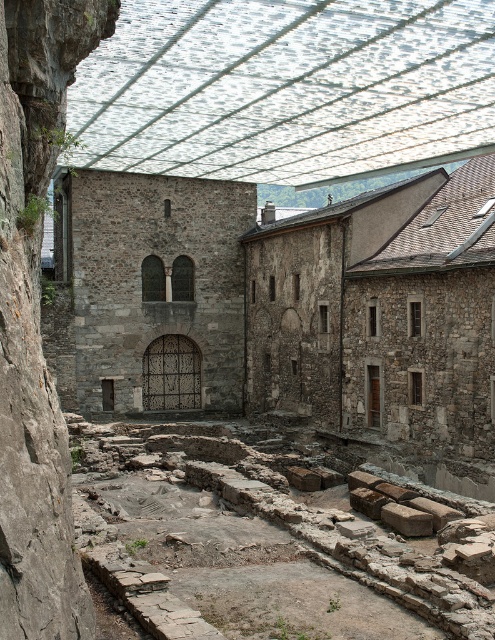
Based on the photo, you are standing at the point marked by coordinates point (244, 544) in the archaeological site. What is the immediate terrain you are standing on?

The point (244, 544) indicates gray stone ruins at lower center, so you are standing on gray stone ruins.

You are an archaeologist examining the site. You notice two sets of ruins. The gray stone ruins at lower center and the rustic stone ruins at center. Which of these two occupies more area in the scene?

The rustic stone ruins at center occupies more area than the gray stone ruins at lower center.

You are standing at the entrance of the archaeological site and want to determine the relative positions of two points marked on a map. The points are labeled as point (249,496) and point (96,211). Based on the scene, which point is nearer to your current position?

Point (249,496) is closer to the viewer than point (96,211).